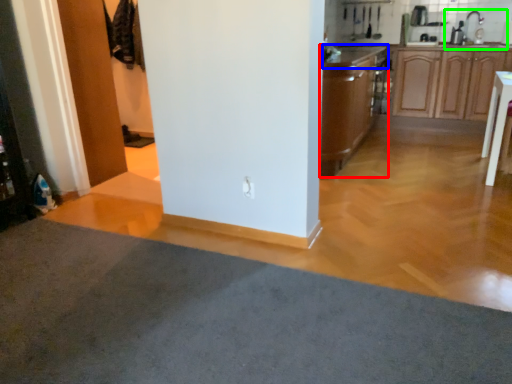
Question: Considering the real-world distances, which object is farthest from cabinetry (highlighted by a red box)? countertop (highlighted by a blue box) or sink (highlighted by a green box)?

Choices:
 (A) countertop
 (B) sink

Answer: (B)